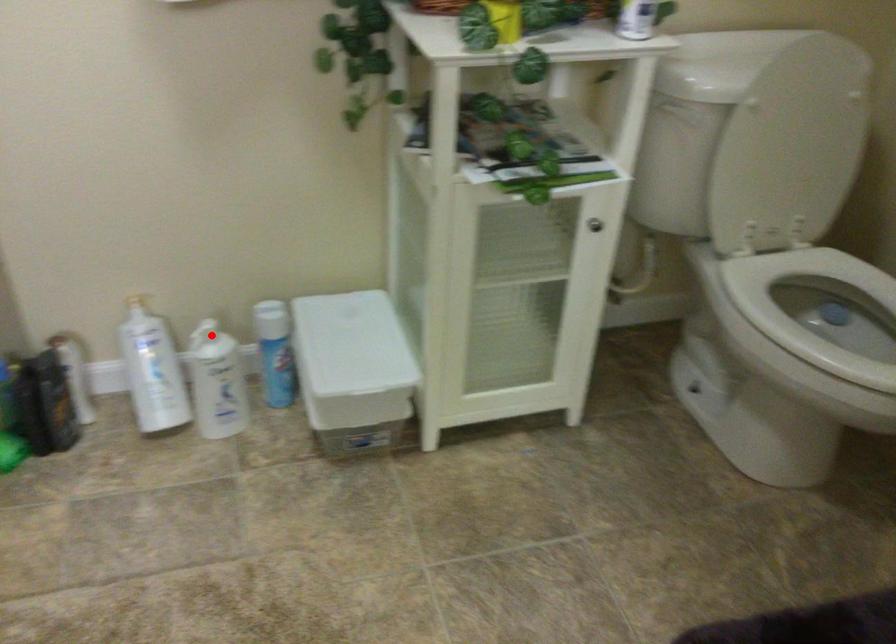
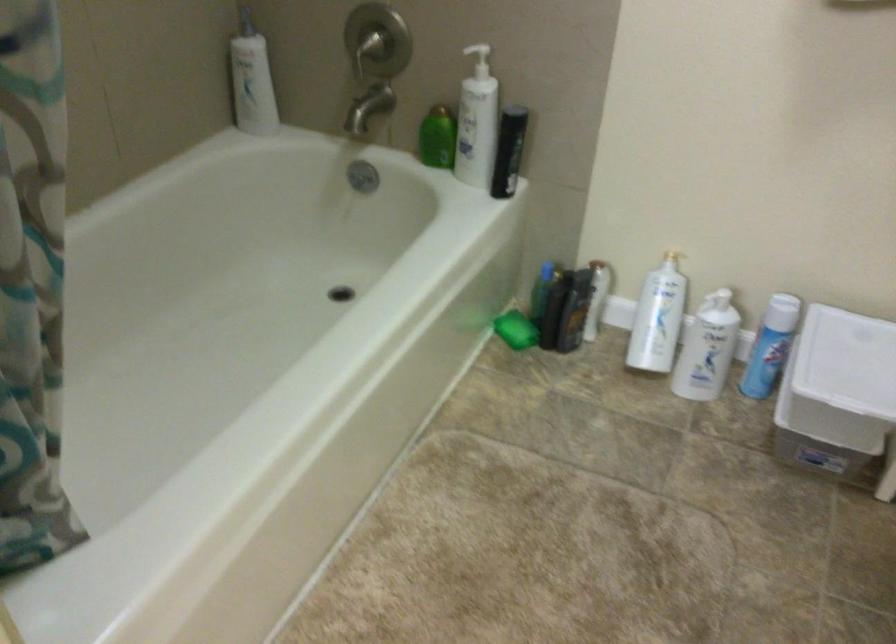
Locate, in the second image, the point that corresponds to the highlighted location in the first image.

(719, 301)